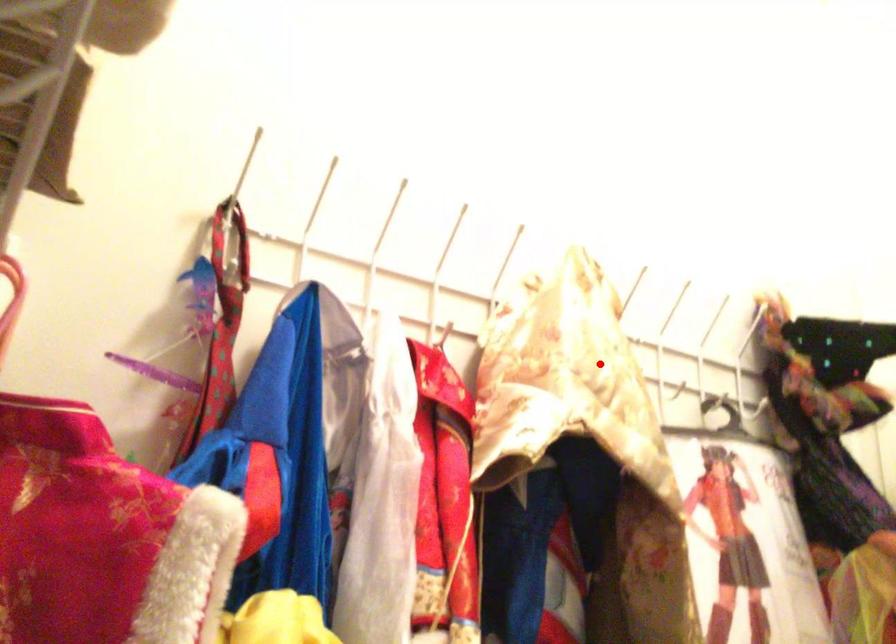
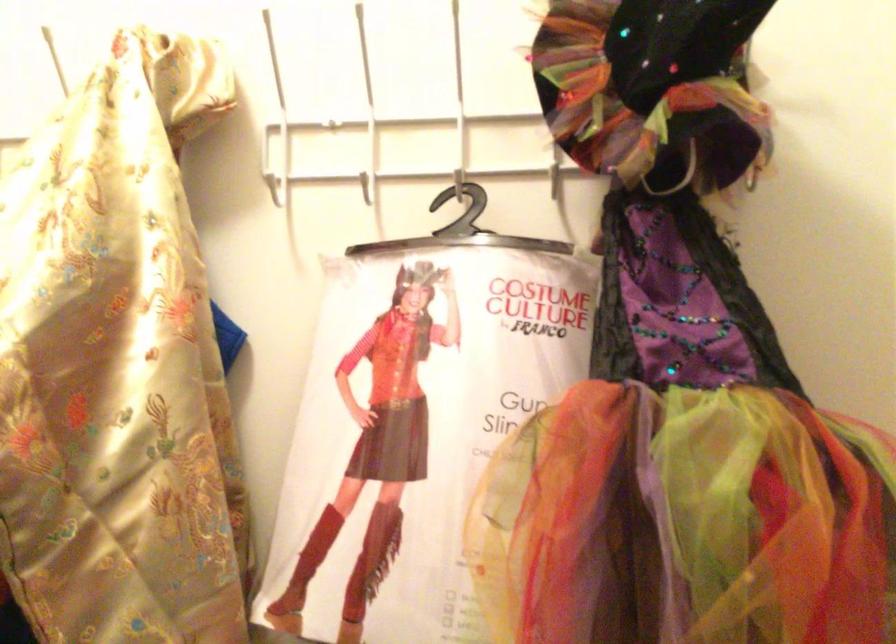
Where in the second image is the point corresponding to the highlighted location from the first image?

(276, 189)